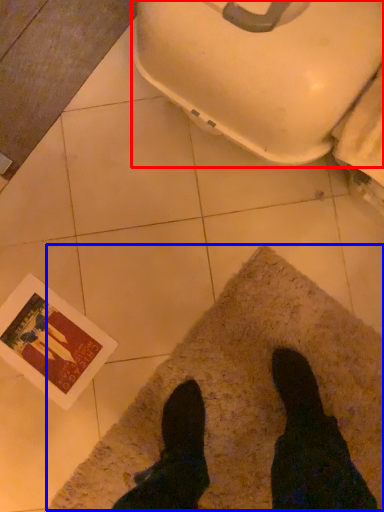
Question: Among these objects, which one is farthest to the camera, toilet bowl (highlighted by a red box) or mat (highlighted by a blue box)?

Choices:
 (A) toilet bowl
 (B) mat

Answer: (B)